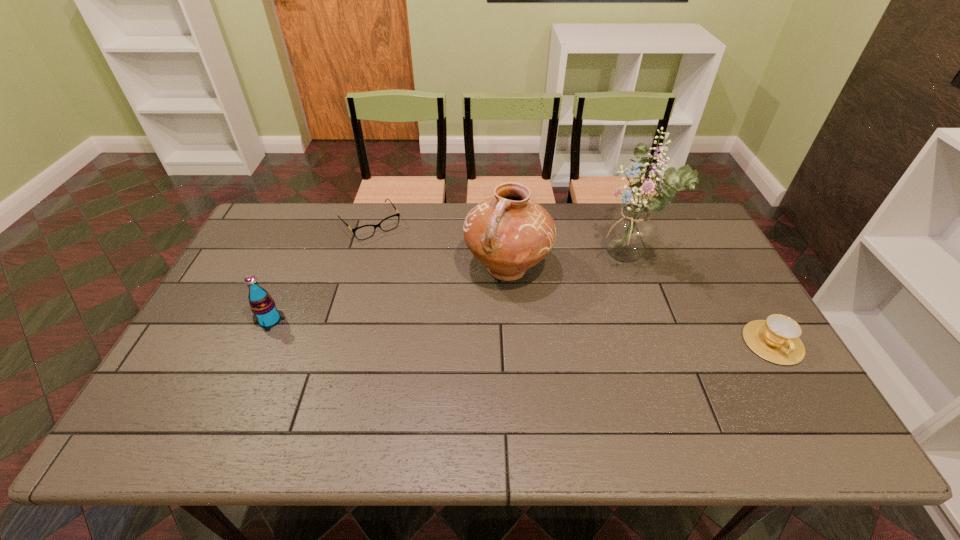
Locate an element on the screen. This screenshot has width=960, height=540. free area in between the spectacles and the cup is located at coordinates (571, 284).

Image resolution: width=960 pixels, height=540 pixels. Identify the location of free point between the bouquet and the soda. (447, 290).

Identify the location of the fourth closest object to the shortest object. The image size is (960, 540). (776, 339).

Find the location of `object that is the closest to the spectacles`. object that is the closest to the spectacles is located at coordinates click(509, 233).

What are the coordinates of `free space that satisfies the following two spatial constraints: 1. on the back side of the leftmost object; 2. on the left side of the fourth object from left to right` in the screenshot? It's located at (298, 260).